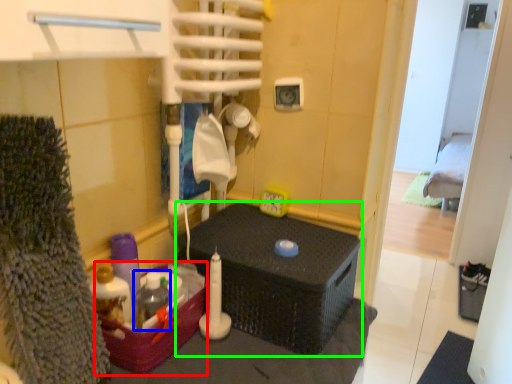
Question: Based on their relative distances, which object is nearer to box (highlighted by a red box)? Choose from bottle (highlighted by a blue box) and furniture (highlighted by a green box).

Choices:
 (A) bottle
 (B) furniture

Answer: (A)